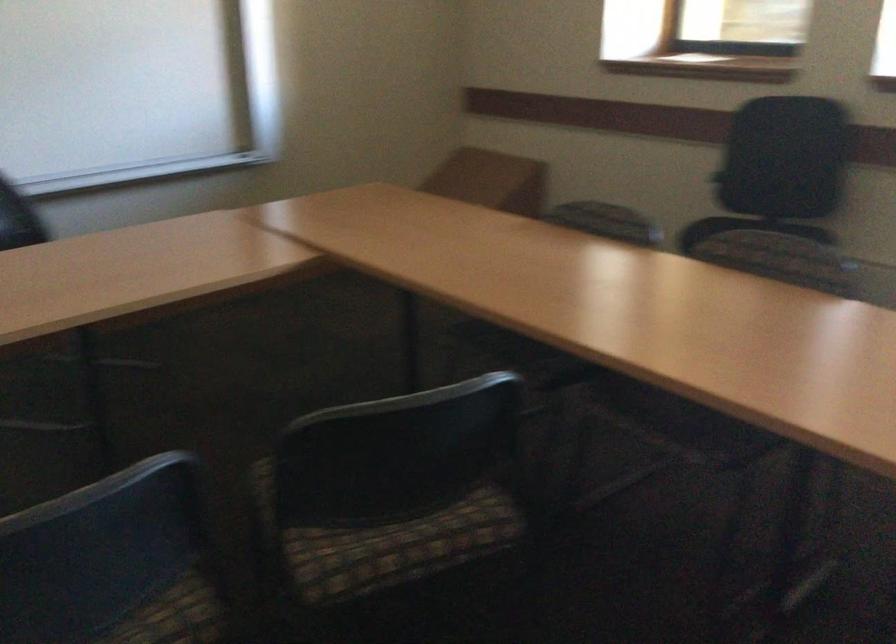
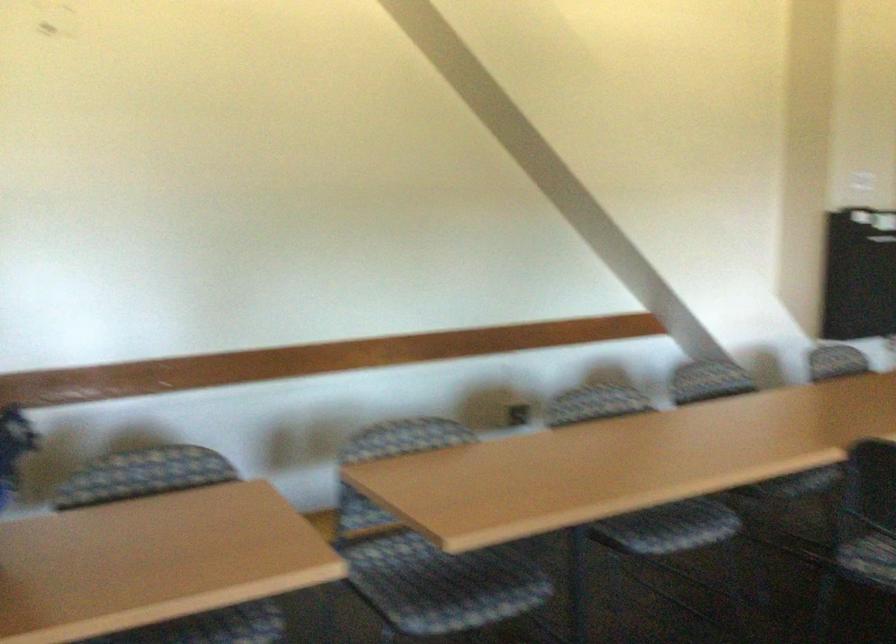
Question: The camera is either moving clockwise (left) or counter-clockwise (right) around the object. The first image is from the beginning of the video and the second image is from the end. Is the camera moving left or right when shooting the video?

Choices:
 (A) Left
 (B) Right

Answer: (B)